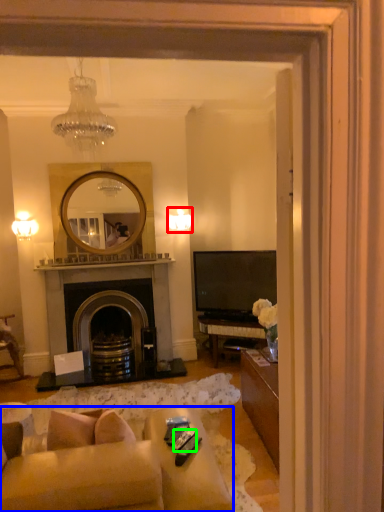
Question: Which object is the farthest from lamp (highlighted by a red box)? Choose among these: studio couch (highlighted by a blue box) or remote control (highlighted by a green box).

Choices:
 (A) studio couch
 (B) remote control

Answer: (A)